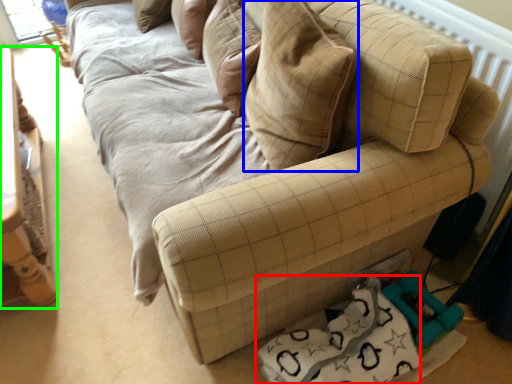
Question: Considering the real-world distances, which object is closest to material (highlighted by a red box)? throw pillow (highlighted by a blue box) or furniture (highlighted by a green box).

Choices:
 (A) throw pillow
 (B) furniture

Answer: (A)